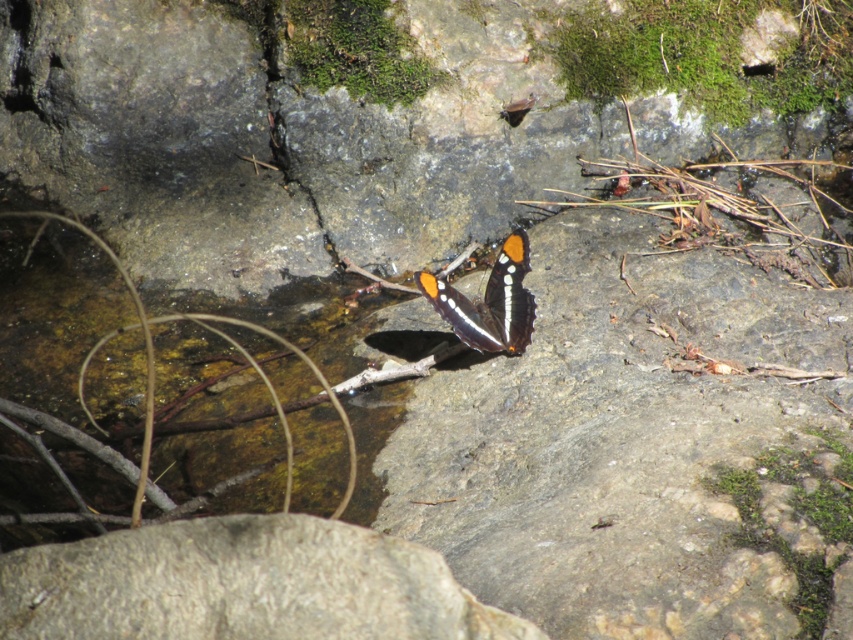
You are an entomologist observing the scene. You notice the gray rough boulder at center and the shiny orange and black wings at center. Which object is located below the other?

The gray rough boulder at center is positioned under shiny orange and black wings at center, so the boulder is below the wings.

You are an entomologist observing the butterfly in the scene. You need to place a small net to the right of the shiny orange and black wings at center to capture it without disturbing the gray rough boulder at center. Is there enough space between them for the net?

The gray rough boulder at center is positioned on the left side of shiny orange and black wings at center, so placing the net to the right of the shiny orange and black wings at center would not interfere with the gray rough boulder at center as they are aligned horizontally. There should be sufficient space for the net.